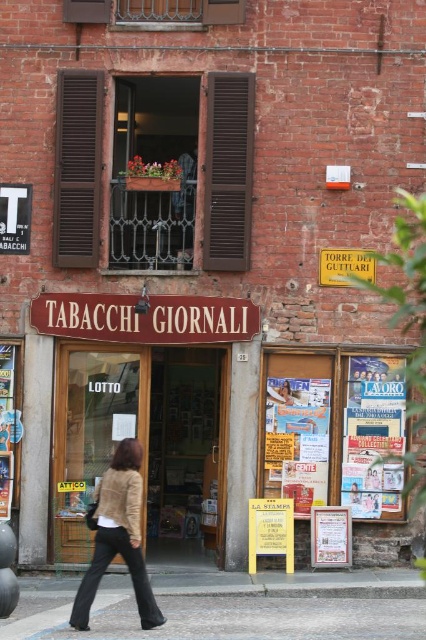
Question: Does gray concrete pavement at lower center have a lesser width compared to beige fuzzy jacket at lower left?

Choices:
 (A) yes
 (B) no

Answer: (B)

Question: Can you confirm if gray concrete pavement at lower center is positioned below beige fuzzy jacket at lower left?

Choices:
 (A) no
 (B) yes

Answer: (B)

Question: Which point is farther from the camera taking this photo?

Choices:
 (A) (120, 520)
 (B) (285, 600)

Answer: (B)

Question: Does gray concrete pavement at lower center appear over beige fuzzy jacket at lower left?

Choices:
 (A) no
 (B) yes

Answer: (A)